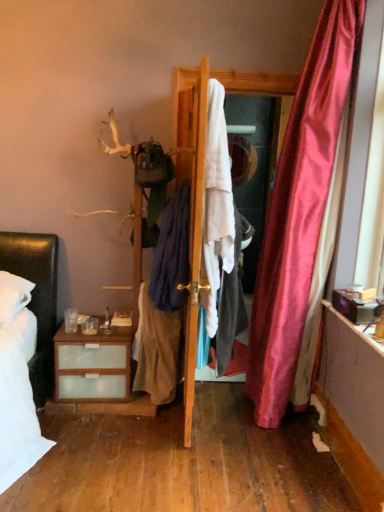
Question: Does dark blue fabric at center, the second clothing from the left, have a lesser height compared to wooden door at center?

Choices:
 (A) no
 (B) yes

Answer: (B)

Question: Is the surface of dark blue fabric at center, the second clothing positioned from the right, in direct contact with wooden door at center?

Choices:
 (A) no
 (B) yes

Answer: (A)

Question: Does dark blue fabric at center, the second clothing from the left, have a greater height compared to wooden door at center?

Choices:
 (A) no
 (B) yes

Answer: (A)

Question: Is the position of dark blue fabric at center, the second clothing positioned from the right, less distant than that of wooden door at center?

Choices:
 (A) no
 (B) yes

Answer: (A)

Question: Could you tell me if dark blue fabric at center, the second clothing positioned from the right, is facing wooden door at center?

Choices:
 (A) no
 (B) yes

Answer: (A)

Question: Would you say white fabric at center is inside or outside white cotton shirt at center, placed as the third clothing when sorted from left to right?

Choices:
 (A) outside
 (B) inside

Answer: (A)

Question: Is white fabric at center to the left or to the right of white cotton shirt at center, placed as the third clothing when sorted from left to right, in the image?

Choices:
 (A) left
 (B) right

Answer: (B)

Question: Looking at the image, does white fabric at center seem bigger or smaller compared to white cotton shirt at center, placed as the third clothing when sorted from left to right?

Choices:
 (A) small
 (B) big

Answer: (A)

Question: Does point (195, 147) appear closer or farther from the camera than point (236, 247)?

Choices:
 (A) closer
 (B) farther

Answer: (A)

Question: Is light brown fabric skirt at center, the third clothing viewed from the right, situated inside wooden door at center or outside?

Choices:
 (A) inside
 (B) outside

Answer: (B)

Question: In the image, is light brown fabric skirt at center, which ranks as the first clothing in left-to-right order, on the left side or the right side of wooden door at center?

Choices:
 (A) right
 (B) left

Answer: (B)

Question: Considering the positions of light brown fabric skirt at center, which ranks as the first clothing in left-to-right order, and wooden door at center in the image, is light brown fabric skirt at center, which ranks as the first clothing in left-to-right order, bigger or smaller than wooden door at center?

Choices:
 (A) small
 (B) big

Answer: (A)

Question: From a real-world perspective, is light brown fabric skirt at center, the third clothing viewed from the right, positioned above or below wooden door at center?

Choices:
 (A) below
 (B) above

Answer: (A)

Question: From a real-world perspective, is dark blue fabric at center, the second clothing positioned from the right, positioned above or below white fabric at center?

Choices:
 (A) below
 (B) above

Answer: (A)

Question: From the image's perspective, is dark blue fabric at center, the second clothing from the left, above or below white fabric at center?

Choices:
 (A) above
 (B) below

Answer: (B)